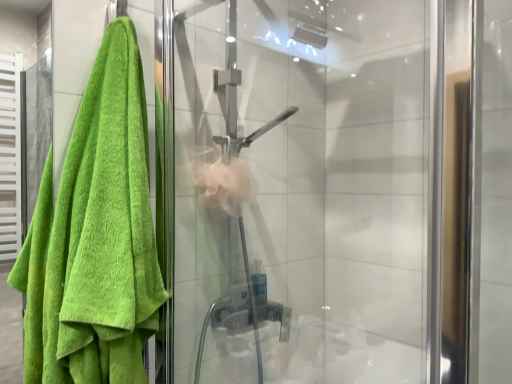
Question: Is green terry cloth towel at left touching transparent glass shower door at center?

Choices:
 (A) no
 (B) yes

Answer: (A)

Question: Is green terry cloth towel at left to the left of transparent glass shower door at center from the viewer's perspective?

Choices:
 (A) no
 (B) yes

Answer: (B)

Question: From the image's perspective, is green terry cloth towel at left on transparent glass shower door at center?

Choices:
 (A) no
 (B) yes

Answer: (A)

Question: From a real-world perspective, is green terry cloth towel at left on transparent glass shower door at center?

Choices:
 (A) no
 (B) yes

Answer: (A)

Question: Is green terry cloth towel at left aimed at transparent glass shower door at center?

Choices:
 (A) yes
 (B) no

Answer: (B)

Question: Is green terry cloth towel at left outside of transparent glass shower door at center?

Choices:
 (A) yes
 (B) no

Answer: (A)

Question: Considering the relative positions of transparent glass shower door at center and green terry cloth towel at left in the image provided, is transparent glass shower door at center to the left of green terry cloth towel at left from the viewer's perspective?

Choices:
 (A) yes
 (B) no

Answer: (B)

Question: From the image's perspective, is transparent glass shower door at center below green terry cloth towel at left?

Choices:
 (A) no
 (B) yes

Answer: (A)

Question: Does transparent glass shower door at center have a greater height compared to green terry cloth towel at left?

Choices:
 (A) no
 (B) yes

Answer: (B)

Question: Considering the relative sizes of transparent glass shower door at center and green terry cloth towel at left in the image provided, is transparent glass shower door at center wider than green terry cloth towel at left?

Choices:
 (A) yes
 (B) no

Answer: (A)

Question: Can green terry cloth towel at left be found inside transparent glass shower door at center?

Choices:
 (A) yes
 (B) no

Answer: (B)

Question: From a real-world perspective, is transparent glass shower door at center beneath green terry cloth towel at left?

Choices:
 (A) no
 (B) yes

Answer: (A)

Question: Is green terry cloth towel at left wider or thinner than transparent glass shower door at center?

Choices:
 (A) wide
 (B) thin

Answer: (B)